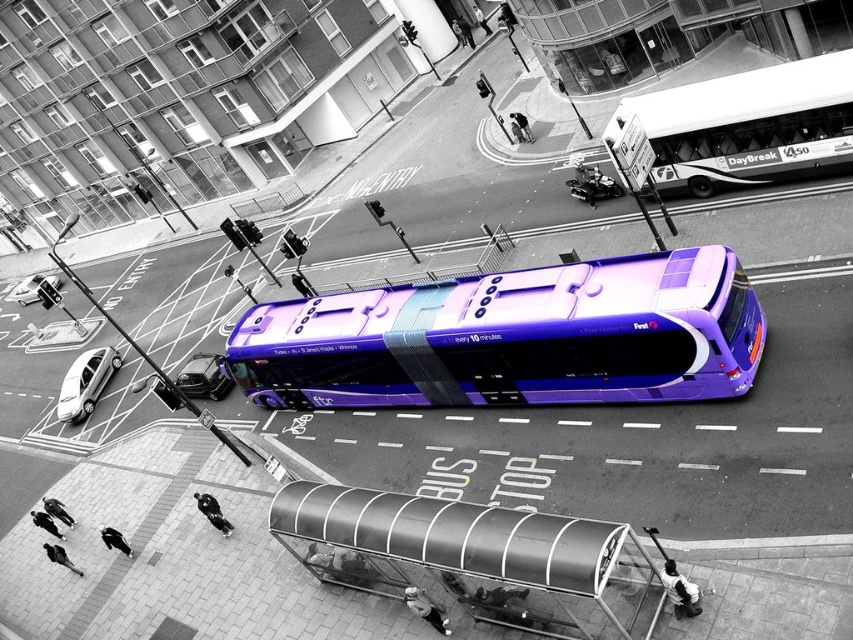
You are a passenger waiting at the metallic silver bus stop at lower center. You see the white glossy bus at upper right approaching the intersection. Based on the scene, will the bus be able to reach you without detouring?

The metallic silver bus stop at lower center is located below the white glossy bus at upper right, meaning the bus is positioned higher up in the image. Since the bus is heading towards the right side of the image, it would need to turn downward to reach the bus stop. Therefore, the bus will have to detour to reach you.

You are standing at the edge of the street and see the metallic silver scooter at center. If you want to take a photo of it with your phone, which has a maximum zoom range of 10 meters, will you be able to capture the scooter clearly without moving closer?

The metallic silver scooter at center is 27.52 meters away from the camera. Since your phone has a maximum zoom range of 10 meters, you won cannot capture the scooter clearly without moving closer because the distance exceeds the zoom capability.

You are a passenger waiting at the metallic silver bus stop at lower center and want to catch the white glossy bus at upper right. The bus is moving towards you at a speed of 15 km per hour. If you start walking towards the bus at a speed of 5 km per hour, will you be able to reach the bus before it passes by?

The metallic silver bus stop at lower center and white glossy bus at upper right are 15.85 meters apart. The bus is moving towards you at 15 km per hour, while you can walk at 5 km per hour. Since the bus is approaching faster than your walking speed, you will not be able to reach the bus before it passes by.